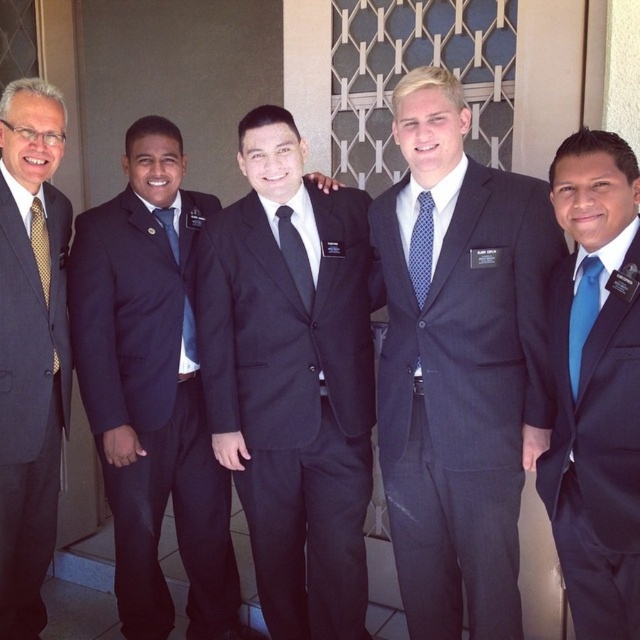
Question: Which point appears farthest from the camera in this image?

Choices:
 (A) (51, 307)
 (B) (285, 252)

Answer: (B)

Question: Which of the following is the farthest from the observer?

Choices:
 (A) black pinstripe suit at center
 (B) black silk tie at center
 (C) gold textured tie at left
 (D) blue satin tie at center

Answer: (B)

Question: Can you confirm if navy pinstripe suit at center is positioned to the right of matte gold tie at left?

Choices:
 (A) no
 (B) yes

Answer: (B)

Question: Is dark blue pinstripe suit at center smaller than blue silk tie at right?

Choices:
 (A) no
 (B) yes

Answer: (A)

Question: Considering the relative positions of navy pinstripe suit at center and blue satin tie at center in the image provided, where is navy pinstripe suit at center located with respect to blue satin tie at center?

Choices:
 (A) right
 (B) left

Answer: (B)

Question: Which of the following is the farthest from the observer?

Choices:
 (A) blue silk tie at right
 (B) matte blue tie at left

Answer: (B)